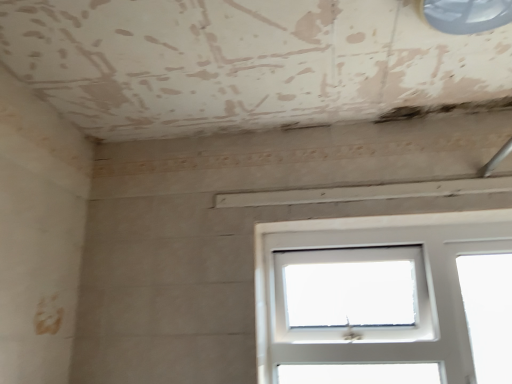
Question: Is transparent plastic window at upper right, acting as the 2th window starting from the bottom, bigger or smaller than white plastic window at center, positioned as the 1th window in back-to-front order?

Choices:
 (A) small
 (B) big

Answer: (A)

Question: In the image, is transparent plastic window at upper right, the second window viewed from the back, positioned in front of or behind white plastic window at center, acting as the second window starting from the top?

Choices:
 (A) behind
 (B) front

Answer: (B)

Question: Based on their positions, is transparent plastic window at upper right, the second window viewed from the back, located to the left or right of white plastic window at center, which appears as the 2th window when viewed from the front?

Choices:
 (A) left
 (B) right

Answer: (A)

Question: From a real-world perspective, is white plastic window at center, which appears as the 2th window when viewed from the front, above or below transparent plastic window at upper right, the first window from the top?

Choices:
 (A) below
 (B) above

Answer: (A)

Question: Based on their sizes in the image, would you say white plastic window at center, positioned as the 1th window in back-to-front order, is bigger or smaller than transparent plastic window at upper right, placed as the first window when sorted from front to back?

Choices:
 (A) big
 (B) small

Answer: (A)

Question: Looking at their shapes, would you say white plastic window at center, positioned as the 1th window in back-to-front order, is wider or thinner than transparent plastic window at upper right, the second window viewed from the back?

Choices:
 (A) thin
 (B) wide

Answer: (A)

Question: In terms of height, does white plastic window at center, acting as the second window starting from the top, look taller or shorter compared to transparent plastic window at upper right, acting as the 2th window starting from the bottom?

Choices:
 (A) tall
 (B) short

Answer: (A)